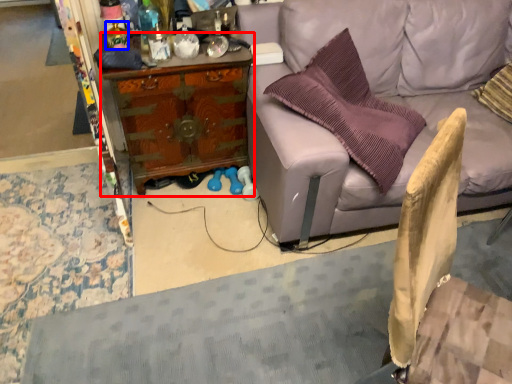
Question: Which object appears closest to the camera in this image, desk (highlighted by a red box) or bottle (highlighted by a blue box)?

Choices:
 (A) desk
 (B) bottle

Answer: (B)